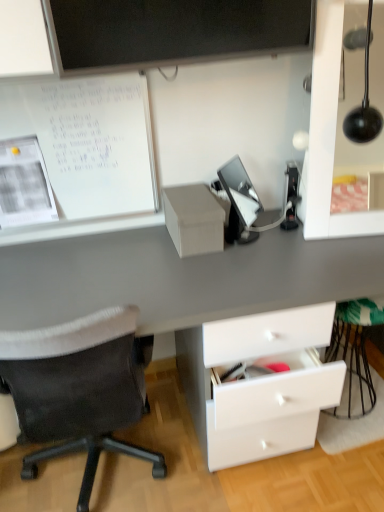
This screenshot has width=384, height=512. In order to click on free location in front of matte cardboard box at center in this screenshot , I will do `click(201, 269)`.